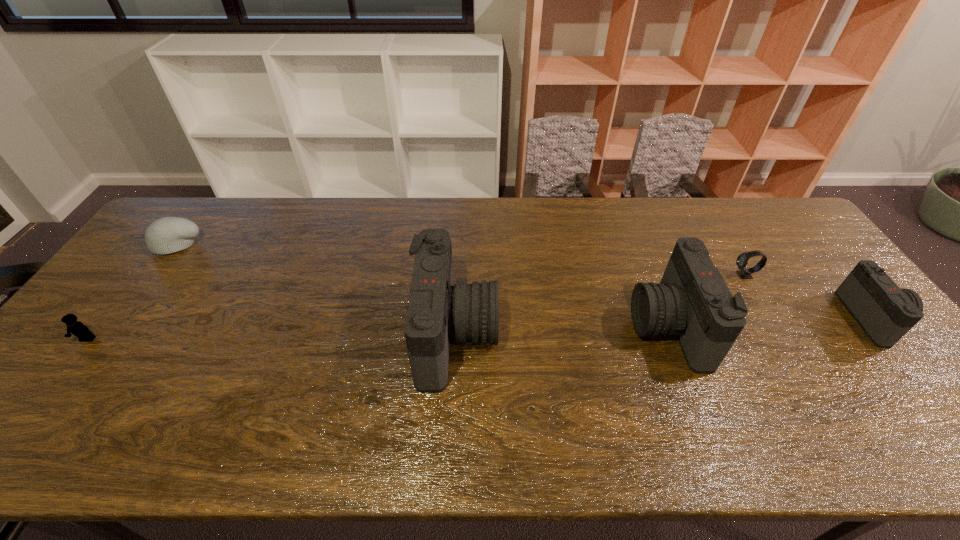
Find the location of `the third object from left to right`. the third object from left to right is located at coordinates (438, 311).

In order to click on the fourth object from left to right in this screenshot , I will do `click(692, 302)`.

At what (x,y) coordinates should I click in order to perform the action: click on the second tallest object. Please return your answer as a coordinate pair (x, y). This screenshot has height=540, width=960. Looking at the image, I should click on (692, 302).

I want to click on the fourth shortest object, so click(x=885, y=312).

This screenshot has width=960, height=540. I want to click on the rightmost camera, so click(x=885, y=312).

The image size is (960, 540). Find the location of `the fifth object from left to right`. the fifth object from left to right is located at coordinates (744, 273).

Find the location of `watch`. watch is located at coordinates (744, 273).

I want to click on the farthest object, so click(166, 235).

Locate an element on the screen. The width and height of the screenshot is (960, 540). Lego is located at coordinates (77, 328).

Where is `blank area located 0.250m at the lens of the leftmost camera`? The width and height of the screenshot is (960, 540). blank area located 0.250m at the lens of the leftmost camera is located at coordinates (591, 334).